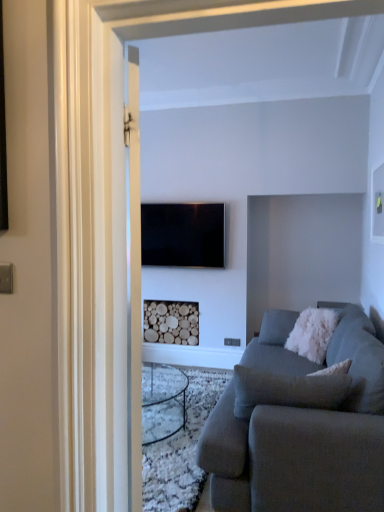
This screenshot has width=384, height=512. I want to click on free point above wooden logs at center (from a real-world perspective), so click(169, 301).